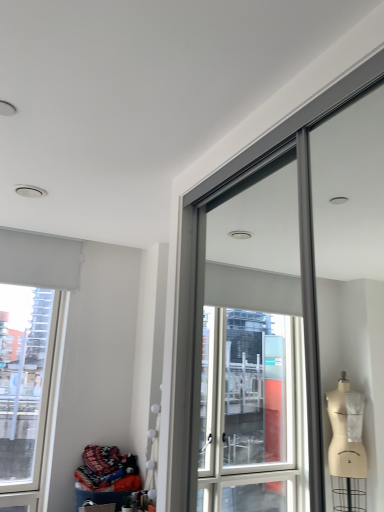
What do you see at coordinates (32, 358) in the screenshot?
I see `white matte window at upper left` at bounding box center [32, 358].

At what (x,y) coordinates should I click in order to perform the action: click on white matte window at upper left. Please return your answer as a coordinate pair (x, y). This screenshot has width=384, height=512. Looking at the image, I should click on (32, 358).

Locate an element on the screen. knitted fabric at lower left is located at coordinates (108, 469).

This screenshot has height=512, width=384. What do you see at coordinates (108, 469) in the screenshot?
I see `knitted fabric at lower left` at bounding box center [108, 469].

This screenshot has width=384, height=512. What are the coordinates of `white matte window at upper left` in the screenshot? It's located at (32, 358).

Which is more to the right, knitted fabric at lower left or white matte window at upper left?

knitted fabric at lower left is more to the right.

Is knitted fabric at lower left further to camera compared to white matte window at upper left?

No, knitted fabric at lower left is closer to the camera.

Considering the points (131, 474) and (36, 371), which point is behind, point (131, 474) or point (36, 371)?

The point (36, 371) is farther.

From the image's perspective, is knitted fabric at lower left located above white matte window at upper left?

No, from the image's perspective, knitted fabric at lower left is not on top of white matte window at upper left.

From a real-world perspective, which is physically below, knitted fabric at lower left or white matte window at upper left?

knitted fabric at lower left.

Considering the sizes of objects knitted fabric at lower left and white matte window at upper left in the image provided, who is thinner, knitted fabric at lower left or white matte window at upper left?

With smaller width is white matte window at upper left.

Is knitted fabric at lower left taller or shorter than white matte window at upper left?

In the image, knitted fabric at lower left appears to be shorter than white matte window at upper left.

Does knitted fabric at lower left have a smaller size compared to white matte window at upper left?

Yes.

Would you say knitted fabric at lower left is outside white matte window at upper left?

Yes, knitted fabric at lower left is outside of white matte window at upper left.

Are knitted fabric at lower left and white matte window at upper left far apart?

Actually, knitted fabric at lower left and white matte window at upper left are a little close together.

Is knitted fabric at lower left aimed at white matte window at upper left?

No, knitted fabric at lower left is not facing towards white matte window at upper left.

How different are the orientations of knitted fabric at lower left and white matte window at upper left in degrees?

They differ by 90 degrees in their facing directions.

How far apart are knitted fabric at lower left and white matte window at upper left?

knitted fabric at lower left is 24.57 inches from white matte window at upper left.

At what (x,y) coordinates should I click in order to perform the action: click on window above the knitted fabric at lower left (from a real-world perspective). Please return your answer as a coordinate pair (x, y). Looking at the image, I should click on (32, 358).

Between white matte window at upper left and knitted fabric at lower left, which one appears on the left side from the viewer's perspective?

Positioned to the left is white matte window at upper left.

Considering their positions, is white matte window at upper left located in front of or behind knitted fabric at lower left?

white matte window at upper left is behind knitted fabric at lower left.

Between point (4, 502) and point (88, 453), which one is positioned in front?

The point (4, 502) is closer to the camera.

From the image's perspective, which one is positioned higher, white matte window at upper left or knitted fabric at lower left?

From the image's view, white matte window at upper left is above.

From a real-world perspective, who is located higher, white matte window at upper left or knitted fabric at lower left?

In real-world perspective, white matte window at upper left is above.

Considering the relative sizes of white matte window at upper left and knitted fabric at lower left in the image provided, is white matte window at upper left wider than knitted fabric at lower left?

No.

Considering the relative sizes of white matte window at upper left and knitted fabric at lower left in the image provided, is white matte window at upper left shorter than knitted fabric at lower left?

Incorrect, the height of white matte window at upper left does not fall short of that of knitted fabric at lower left.

Consider the image. Does white matte window at upper left have a smaller size compared to knitted fabric at lower left?

No, white matte window at upper left is not smaller than knitted fabric at lower left.

Looking at this image, is white matte window at upper left not inside knitted fabric at lower left?

Yes, white matte window at upper left is not within knitted fabric at lower left.

Is white matte window at upper left touching knitted fabric at lower left?

No, white matte window at upper left is not making contact with knitted fabric at lower left.

Is white matte window at upper left positioned with its back to knitted fabric at lower left?

white matte window at upper left is not turned away from knitted fabric at lower left.

Identify the location of window behind the knitted fabric at lower left. (32, 358).

At what (x,y) coordinates should I click in order to perform the action: click on material on the right of white matte window at upper left. Please return your answer as a coordinate pair (x, y). The width and height of the screenshot is (384, 512). Looking at the image, I should click on [x=108, y=469].

Identify the location of material below the white matte window at upper left (from the image's perspective). (108, 469).